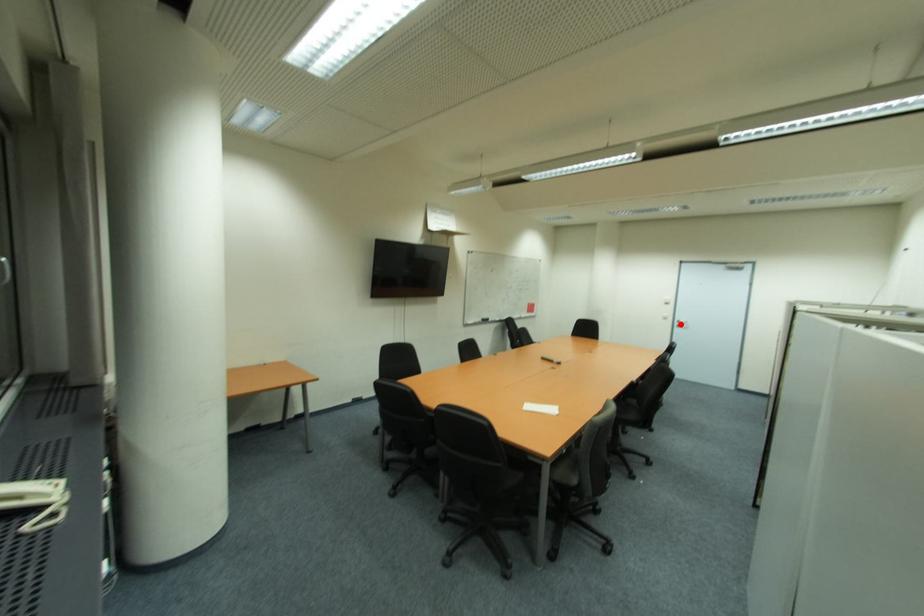
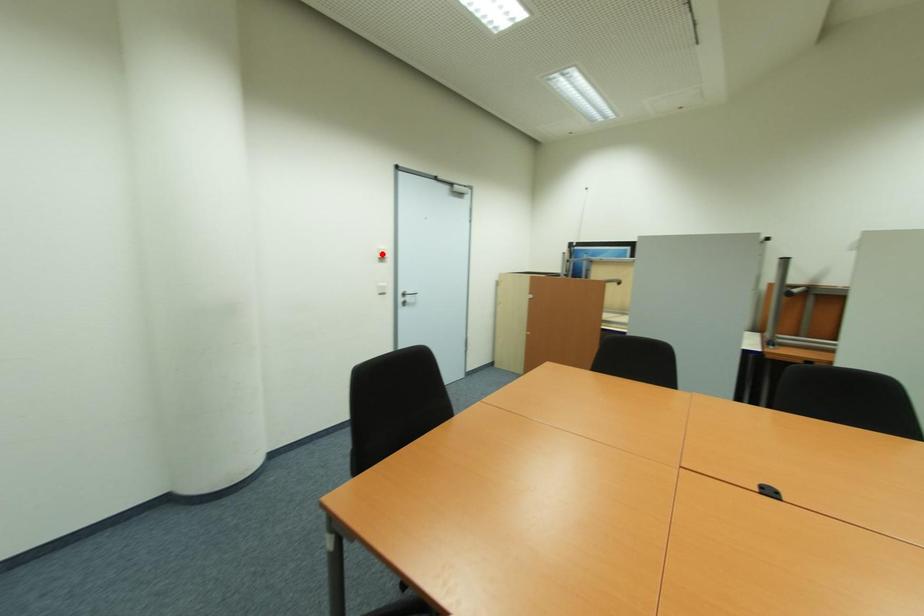
I am providing you with two images of the same scene from different viewpoints. A red point is marked on the first image and another point is marked on the second image. Is the marked point in image1 the same physical position as the marked point in image2?

No